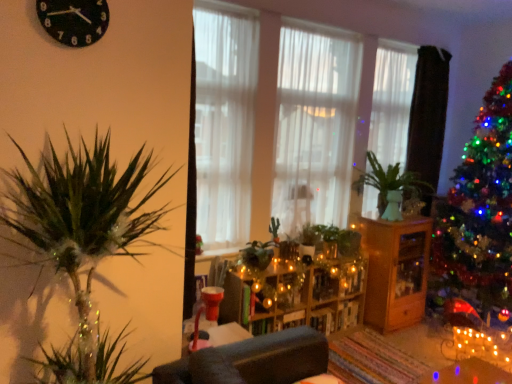
You are a GUI agent. You are given a task and a screenshot of the screen. Output one action in this format:
    pyautogui.click(x=<x>, y=<y>)
    Task: Click on the white sheer curtain at center, acting as the first curtain starting from the left
    Image resolution: width=512 pixels, height=384 pixels.
    Given the screenshot: What is the action you would take?
    click(224, 121)

This screenshot has height=384, width=512. I want to click on green matte vase at center, so click(x=392, y=182).

Locate an element on the screen. white sheer curtain at center, which ranks as the third curtain in right-to-left order is located at coordinates (224, 121).

Is white sheer curtain at center, the second curtain viewed from the right, far from wooden cabinet at center?

No, white sheer curtain at center, the second curtain viewed from the right, is not far away from wooden cabinet at center.

Which object is thinner, white sheer curtain at center, which ranks as the second curtain in left-to-right order, or wooden cabinet at center?

white sheer curtain at center, which ranks as the second curtain in left-to-right order.

Between white sheer curtain at center, which ranks as the second curtain in left-to-right order, and wooden cabinet at center, which one appears on the right side from the viewer's perspective?

Positioned to the right is wooden cabinet at center.

Looking at this image, in terms of size, does wooden shelves at center appear bigger or smaller than wooden cabinet at center?

wooden shelves at center is smaller than wooden cabinet at center.

Considering the positions of objects wooden shelves at center and wooden cabinet at center in the image provided, who is behind, wooden shelves at center or wooden cabinet at center?

wooden cabinet at center is behind.

From the image's perspective, is wooden shelves at center on top of wooden cabinet at center?

Correct, wooden shelves at center appears higher than wooden cabinet at center in the image.

Based on the photo, does wooden shelves at center appear on the left side of wooden cabinet at center?

Yes.

Who is bigger, green matte vase at center or white sheer curtain at center, the second curtain viewed from the right?

Bigger between the two is white sheer curtain at center, the second curtain viewed from the right.

In the scene shown: Considering the sizes of green matte vase at center and white sheer curtain at center, which ranks as the second curtain in left-to-right order, in the image, is green matte vase at center taller or shorter than white sheer curtain at center, which ranks as the second curtain in left-to-right order,?

Clearly, green matte vase at center is shorter compared to white sheer curtain at center, which ranks as the second curtain in left-to-right order.

Is point (374, 155) less distant than point (296, 217)?

No, (374, 155) is behind (296, 217).

Is green matte vase at center facing away from white sheer curtain at center, the second curtain viewed from the right?

No, green matte vase at center is not facing the opposite direction of white sheer curtain at center, the second curtain viewed from the right.

From the image's perspective, does white sheer curtain at center, the second curtain viewed from the right, appear lower than white sheer curtain at center, acting as the first curtain starting from the left?

No.

Is white sheer curtain at center, which ranks as the second curtain in left-to-right order, facing away from white sheer curtain at center, acting as the first curtain starting from the left?

No, white sheer curtain at center, acting as the first curtain starting from the left, is not at the back of white sheer curtain at center, which ranks as the second curtain in left-to-right order.

Does white sheer curtain at center, which ranks as the second curtain in left-to-right order, have a greater width compared to white sheer curtain at center, which ranks as the third curtain in right-to-left order?

Correct, the width of white sheer curtain at center, which ranks as the second curtain in left-to-right order, exceeds that of white sheer curtain at center, which ranks as the third curtain in right-to-left order.

Is white sheer curtain at center, which ranks as the second curtain in left-to-right order, positioned beyond the bounds of white sheer curtain at center, acting as the first curtain starting from the left?

That's correct, white sheer curtain at center, which ranks as the second curtain in left-to-right order, is outside of white sheer curtain at center, acting as the first curtain starting from the left.

Considering the relative sizes of wooden cabinet at center and green matte plant at center in the image provided, is wooden cabinet at center shorter than green matte plant at center?

In fact, wooden cabinet at center may be taller than green matte plant at center.

From the picture: Are wooden cabinet at center and green matte plant at center making contact?

No, wooden cabinet at center is not in contact with green matte plant at center.

Is the position of wooden cabinet at center less distant than that of green matte plant at center?

That is False.

Can you confirm if wooden cabinet at center is bigger than green matte plant at center?

Yes.

Is green matte plant at center beside white sheer curtain at center, the first curtain viewed from the right?

No, green matte plant at center is not next to white sheer curtain at center, the first curtain viewed from the right.

Considering the relative sizes of green matte plant at center and white sheer curtain at center, which is the third curtain from left to right, in the image provided, is green matte plant at center taller than white sheer curtain at center, which is the third curtain from left to right,?

No, green matte plant at center is not taller than white sheer curtain at center, which is the third curtain from left to right.

Is green matte plant at center spatially inside white sheer curtain at center, which is the third curtain from left to right, or outside of it?

green matte plant at center is not enclosed by white sheer curtain at center, which is the third curtain from left to right.

In the image, is green matte plant at center positioned in front of or behind white sheer curtain at center, the first curtain viewed from the right?

green matte plant at center is positioned closer to the viewer than white sheer curtain at center, the first curtain viewed from the right.

Can you see transparent glass vase at center-right touching green matte vase at center?

No.

Is point (399, 209) positioned in front of point (374, 173)?

Yes, it is in front of point (374, 173).

Which is behind, transparent glass vase at center-right or green matte vase at center?

transparent glass vase at center-right.

Identify the location of houseplant lying on the right of transparent glass vase at center-right. (392, 182).

The height and width of the screenshot is (384, 512). I want to click on curtain that is the 2nd object above the wooden cabinet at center (from a real-world perspective), so click(314, 128).

The image size is (512, 384). I want to click on table below the wooden shelves at center (from the image's perspective), so click(395, 271).

From the image, which object appears to be farther from white sheer curtain at center, which ranks as the third curtain in right-to-left order, white sheer curtain at center, which ranks as the second curtain in left-to-right order, or wooden shelves at center?

Among the two, wooden shelves at center is located further to white sheer curtain at center, which ranks as the third curtain in right-to-left order.

Based on their spatial positions, is white sheer curtain at center, the second curtain viewed from the right, or green matte vase at center closer to transparent glass vase at center-right?

Among the two, green matte vase at center is located nearer to transparent glass vase at center-right.

Considering their positions, is wooden shelves at center positioned further to green matte vase at center than white sheer curtain at center, which ranks as the second curtain in left-to-right order?

wooden shelves at center is further to green matte vase at center.

From the image, which object appears to be farther from green matte vase at center, white sheer curtain at center, the first curtain viewed from the right, or wooden cabinet at center?

white sheer curtain at center, the first curtain viewed from the right, is positioned further to the anchor green matte vase at center.

Based on their spatial positions, is black plastic clock at upper left or green matte plant at center closer to transparent glass vase at center-right?

The object closer to transparent glass vase at center-right is green matte plant at center.

From the image, which object appears to be farther from white sheer curtain at center, acting as the first curtain starting from the left, wooden shelves at center or transparent glass vase at center-right?

Based on the image, transparent glass vase at center-right appears to be further to white sheer curtain at center, acting as the first curtain starting from the left.

Based on their spatial positions, is white sheer curtain at center, the second curtain viewed from the right, or green matte plant at center further from transparent glass vase at center-right?

white sheer curtain at center, the second curtain viewed from the right, is further to transparent glass vase at center-right.

Considering their positions, is wooden cabinet at center positioned further to white sheer curtain at center, the first curtain viewed from the right, than black plastic clock at upper left?

Based on the image, black plastic clock at upper left appears to be further to white sheer curtain at center, the first curtain viewed from the right.

What are the coordinates of `glass vase between white sheer curtain at center, the second curtain viewed from the right, and wooden shelves at center from top to bottom` in the screenshot? It's located at (393, 206).

Find the location of `glass vase between green matte plant at center and wooden cabinet at center in the horizontal direction`. glass vase between green matte plant at center and wooden cabinet at center in the horizontal direction is located at coordinates (393, 206).

You are a GUI agent. You are given a task and a screenshot of the screen. Output one action in this format:
    pyautogui.click(x=<x>, y=<y>)
    Task: Click on the glass vase that lies between white sheer curtain at center, the second curtain viewed from the right, and green matte plant at center from top to bottom
    
    Given the screenshot: What is the action you would take?
    pyautogui.click(x=393, y=206)

Find the location of `glass vase located between white sheer curtain at center, acting as the first curtain starting from the left, and white sheer curtain at center, the first curtain viewed from the right, in the left-right direction`. glass vase located between white sheer curtain at center, acting as the first curtain starting from the left, and white sheer curtain at center, the first curtain viewed from the right, in the left-right direction is located at coordinates (393, 206).